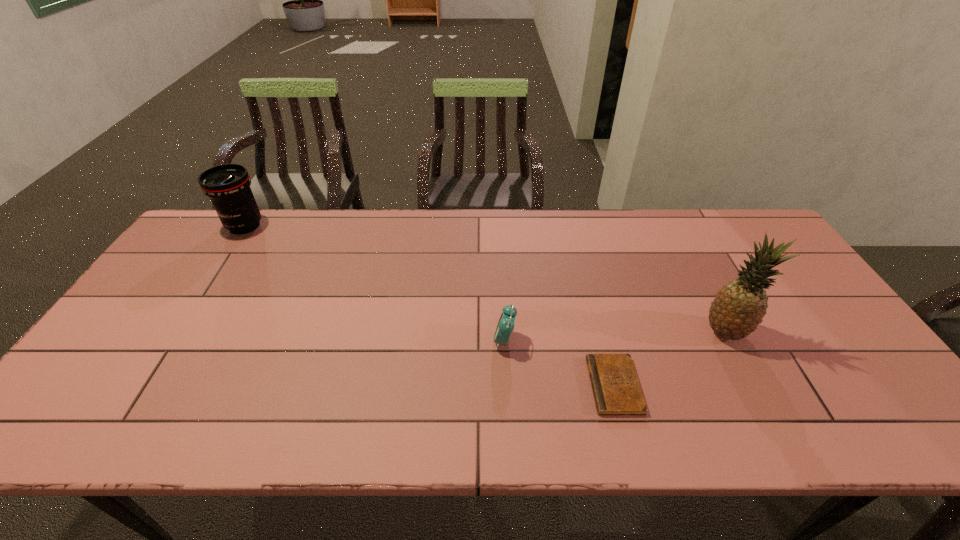
Identify the location of vacant space at the far edge of the desktop. Image resolution: width=960 pixels, height=540 pixels. (267, 251).

In the image, there is a desktop. In order to click on vacant space at the near edge in this screenshot , I will do `click(798, 434)`.

Identify the location of vacant area at the left edge of the desktop. The width and height of the screenshot is (960, 540). [x=167, y=268].

Find the location of `vacant space at the right edge of the desktop`. vacant space at the right edge of the desktop is located at coordinates (767, 294).

Where is `vacant space at the far right corner of the desktop`? The image size is (960, 540). vacant space at the far right corner of the desktop is located at coordinates (762, 243).

At what (x,y) coordinates should I click in order to perform the action: click on unoccupied position between the telephoto lens and the second shortest object. Please return your answer as a coordinate pair (x, y). Looking at the image, I should click on (374, 284).

This screenshot has width=960, height=540. I want to click on free area in between the tallest object and the shortest object, so click(670, 359).

At what (x,y) coordinates should I click in order to perform the action: click on free space between the telephoto lens and the second shortest object. Please return your answer as a coordinate pair (x, y). The image size is (960, 540). Looking at the image, I should click on (374, 284).

The height and width of the screenshot is (540, 960). What are the coordinates of `free area in between the tallest object and the second object from left to right` in the screenshot? It's located at (614, 336).

Locate an element on the screen. free space between the shortest object and the farthest object is located at coordinates (429, 306).